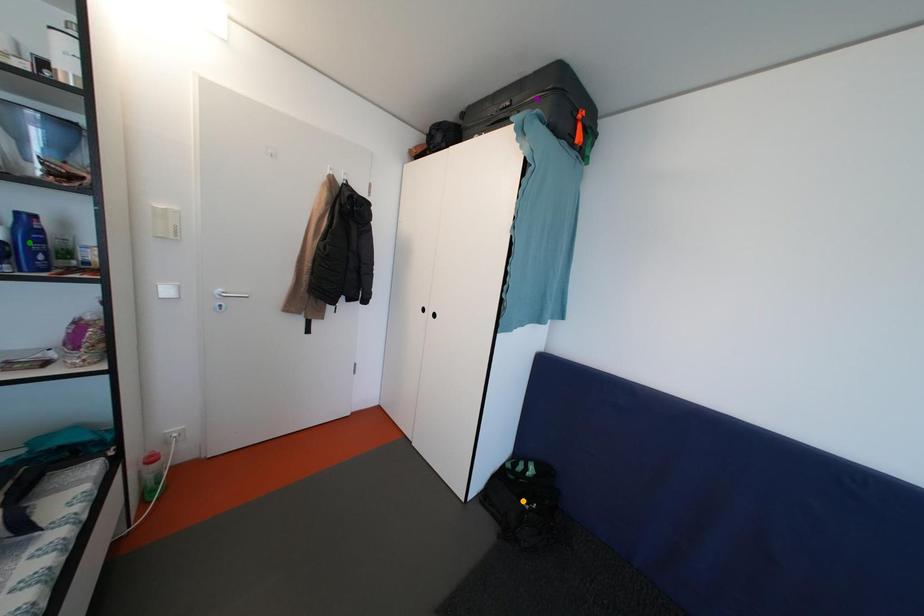
Order these from nearest to farthest:
purple point
orange point
green point

orange point < purple point < green point